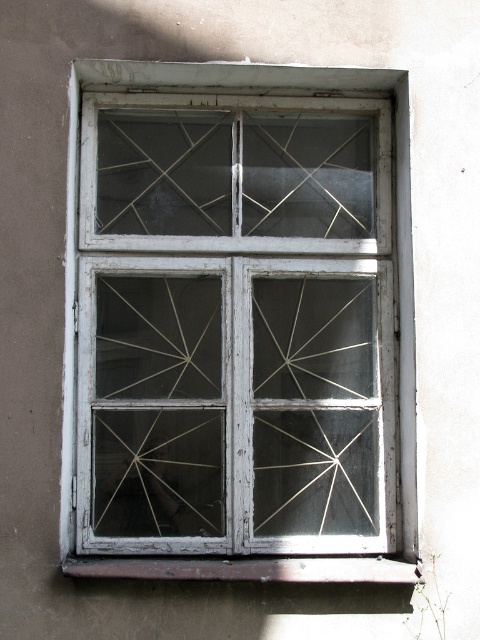
Is point (288, 160) closer to viewer compared to point (377, 561)?

No, it is not.

Between point (405, 515) and point (106, 556), which one is positioned behind?

Point (405, 515)

Between point (407, 452) and point (148, 572), which one is positioned in front?

Point (148, 572) is in front.

In order to click on white painted wood window frame at center in this screenshot , I will do `click(239, 324)`.